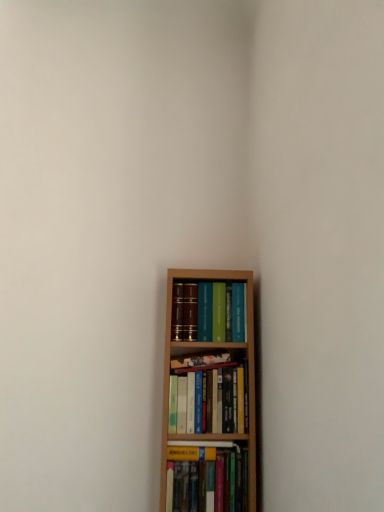
Question: Is hardcover book at lower center, which is the 1th book in bottom-to-top order, to the left of hardcover books at center, arranged as the 2th book when ordered from the bottom, from the viewer's perspective?

Choices:
 (A) no
 (B) yes

Answer: (B)

Question: Considering the relative sizes of hardcover book at lower center, the 4th book viewed from the top, and hardcover books at center, arranged as the third book when viewed from the top, in the image provided, is hardcover book at lower center, the 4th book viewed from the top, smaller than hardcover books at center, arranged as the third book when viewed from the top,?

Choices:
 (A) no
 (B) yes

Answer: (B)

Question: Would you consider hardcover book at lower center, which is the 1th book in bottom-to-top order, to be distant from hardcover books at center, arranged as the 2th book when ordered from the bottom?

Choices:
 (A) yes
 (B) no

Answer: (B)

Question: Is hardcover book at lower center, which is the 1th book in bottom-to-top order, thinner than hardcover books at center, arranged as the third book when viewed from the top?

Choices:
 (A) yes
 (B) no

Answer: (B)

Question: Does hardcover book at lower center, which is the 1th book in bottom-to-top order, have a lesser height compared to hardcover books at center, arranged as the 2th book when ordered from the bottom?

Choices:
 (A) yes
 (B) no

Answer: (A)

Question: In terms of width, does hardcover book at center, which is the 2th book in top-to-bottom order, look wider or thinner when compared to hardcover book at lower center, which is the 1th book in bottom-to-top order?

Choices:
 (A) thin
 (B) wide

Answer: (A)

Question: Is hardcover book at center, which ranks as the 3th book in bottom-to-top order, in front of or behind hardcover book at lower center, the 4th book viewed from the top, in the image?

Choices:
 (A) front
 (B) behind

Answer: (B)

Question: From their relative heights in the image, would you say hardcover book at center, which ranks as the 3th book in bottom-to-top order, is taller or shorter than hardcover book at lower center, which is the 1th book in bottom-to-top order?

Choices:
 (A) tall
 (B) short

Answer: (B)

Question: From the image's perspective, is hardcover book at center, which ranks as the 3th book in bottom-to-top order, located above or below hardcover book at lower center, the 4th book viewed from the top?

Choices:
 (A) below
 (B) above

Answer: (B)

Question: Is hardcover book at center, which is the 2th book in top-to-bottom order, inside or outside of hardcover books at center, arranged as the third book when viewed from the top?

Choices:
 (A) outside
 (B) inside

Answer: (A)

Question: Considering the positions of hardcover book at center, which is the 2th book in top-to-bottom order, and hardcover books at center, arranged as the third book when viewed from the top, in the image, is hardcover book at center, which is the 2th book in top-to-bottom order, bigger or smaller than hardcover books at center, arranged as the third book when viewed from the top,?

Choices:
 (A) small
 (B) big

Answer: (A)

Question: From their relative heights in the image, would you say hardcover book at center, which ranks as the 3th book in bottom-to-top order, is taller or shorter than hardcover books at center, arranged as the 2th book when ordered from the bottom?

Choices:
 (A) tall
 (B) short

Answer: (B)

Question: Does point (203, 359) appear closer or farther from the camera than point (221, 350)?

Choices:
 (A) closer
 (B) farther

Answer: (A)

Question: From a real-world perspective, is hardcover books at center, arranged as the third book when viewed from the top, above or below matte hardcover books at center, marked as the first book in a top-to-bottom arrangement?

Choices:
 (A) above
 (B) below

Answer: (B)

Question: Considering the positions of hardcover books at center, arranged as the third book when viewed from the top, and matte hardcover books at center, marked as the first book in a top-to-bottom arrangement, in the image, is hardcover books at center, arranged as the third book when viewed from the top, taller or shorter than matte hardcover books at center, marked as the first book in a top-to-bottom arrangement,?

Choices:
 (A) short
 (B) tall

Answer: (B)